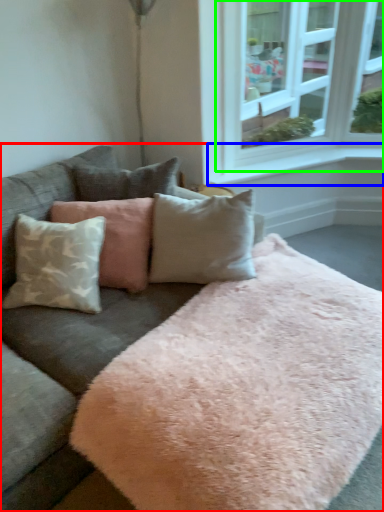
Question: Based on their relative distances, which object is farther from studio couch (highlighted by a red box)? Choose from window sill (highlighted by a blue box) and window (highlighted by a green box).

Choices:
 (A) window sill
 (B) window

Answer: (B)